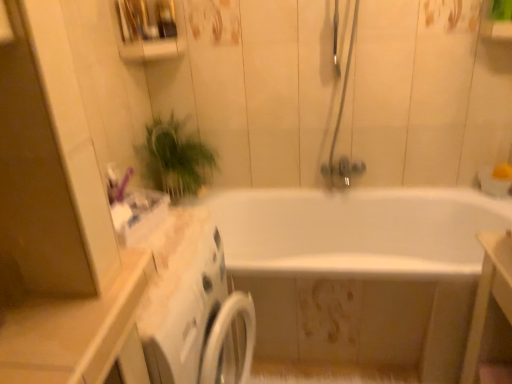
Identify the location of free space underneath matte silver shower door at upper center (from a real-world perspective). (345, 192).